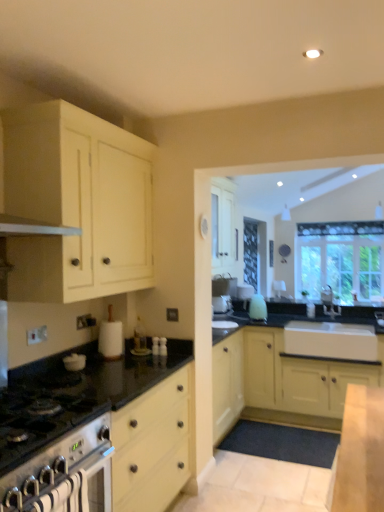
Question: Considering the positions of clear glass window at upper right and matte yellow cabinet at center, the 1th cabinetry when ordered from bottom to top, in the image, is clear glass window at upper right bigger or smaller than matte yellow cabinet at center, the 1th cabinetry when ordered from bottom to top,?

Choices:
 (A) big
 (B) small

Answer: (B)

Question: Is clear glass window at upper right to the left or to the right of matte yellow cabinet at center, which is the 1th cabinetry from back to front, in the image?

Choices:
 (A) right
 (B) left

Answer: (A)

Question: Which of these objects is positioned farthest from the black granite countertop at lower left?

Choices:
 (A) stainless steel oven at lower left
 (B) matte cream cabinet at upper left, acting as the 1th cabinetry starting from the front
 (C) matte yellow cabinet at center, which is the 1th cabinetry from back to front
 (D) white glossy kettle at lower left, which is the first appliance in left-to-right order
 (E) white matte paper towel holder at center, positioned as the 1th appliance in back-to-front order

Answer: (C)

Question: Based on their relative distances, which object is nearer to the clear glass window at upper right?

Choices:
 (A) black granite countertop at lower left
 (B) white matte paper towel holder at center, positioned as the 1th appliance in back-to-front order
 (C) stainless steel oven at lower left
 (D) matte yellow cabinet at center, the 1th cabinetry when ordered from bottom to top
 (E) white glossy kettle at lower left, positioned as the first appliance in front-to-back order

Answer: (D)